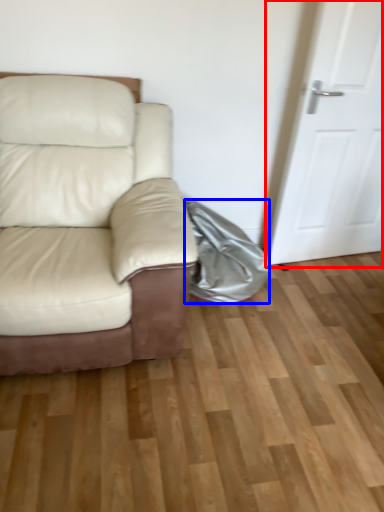
Question: Which object appears farthest to the camera in this image, door (highlighted by a red box) or material (highlighted by a blue box)?

Choices:
 (A) door
 (B) material

Answer: (B)